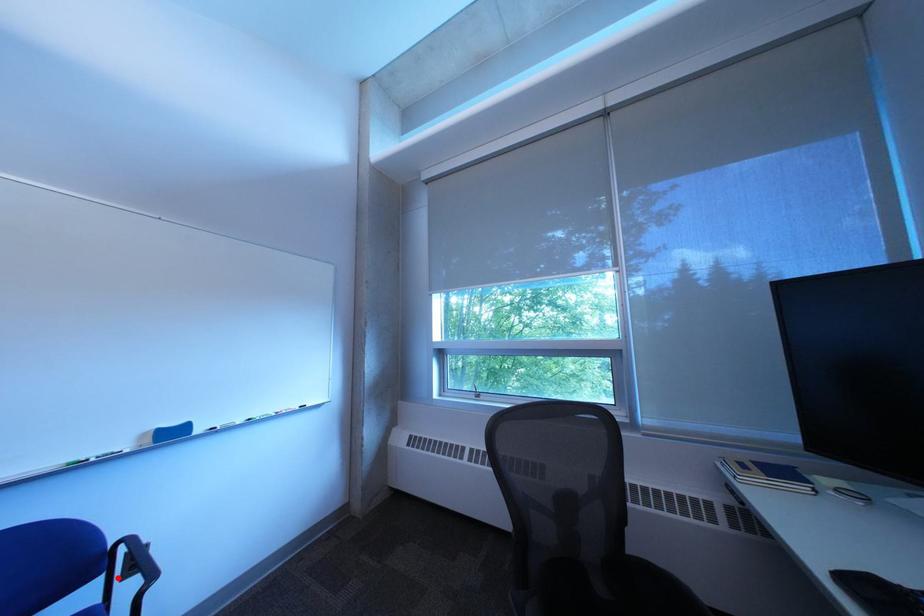
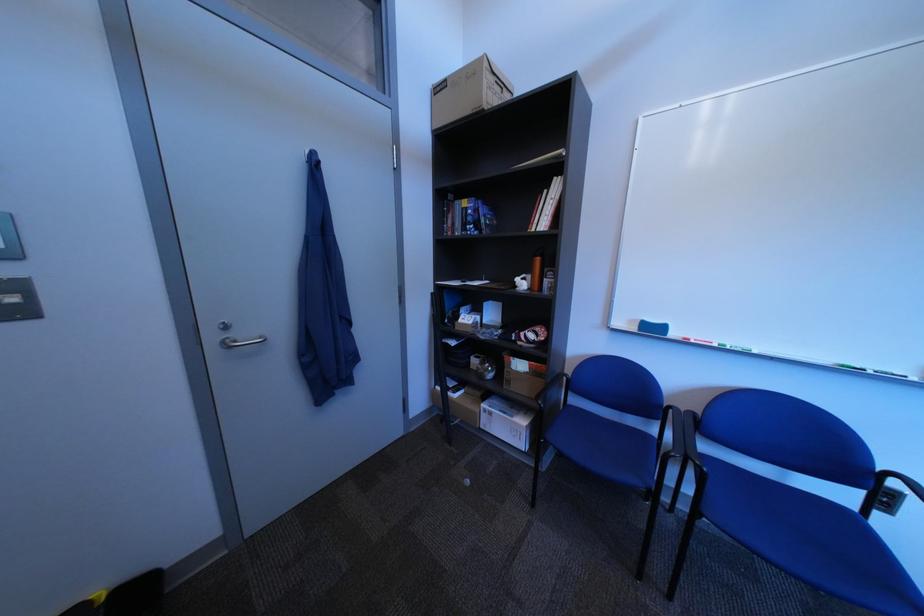
Question: I am providing you with two images of the same scene from different viewpoints. In image1, a red point is highlighted. Considering the same 3D point in image2, which of the following is correct?

Choices:
 (A) It is closer
 (B) It is farther

Answer: (A)